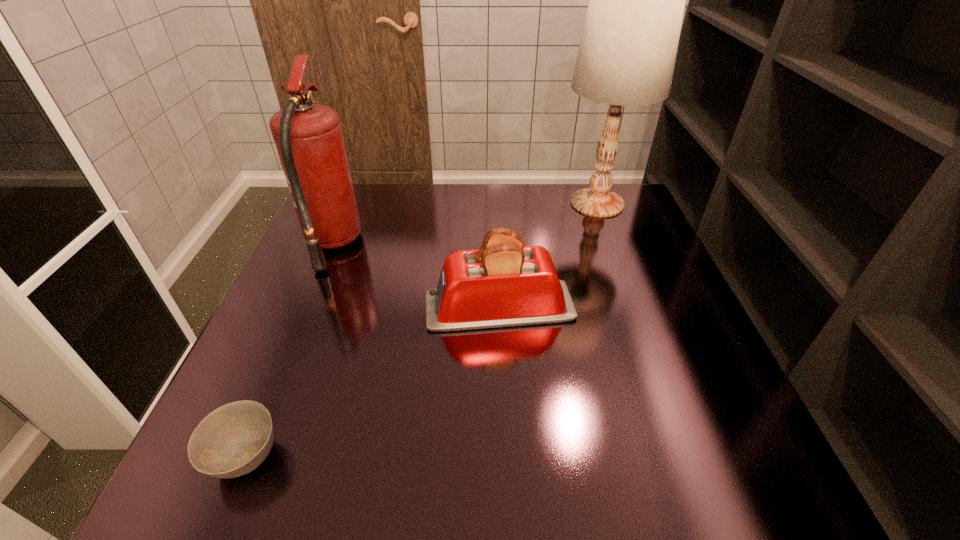
The height and width of the screenshot is (540, 960). Find the location of `free region that satisfies the following two spatial constraints: 1. at the front of the fire extinguisher where the nozzle is aimed; 2. on the right side of the bowl`. free region that satisfies the following two spatial constraints: 1. at the front of the fire extinguisher where the nozzle is aimed; 2. on the right side of the bowl is located at coordinates (242, 457).

I want to click on vacant space that satisfies the following two spatial constraints: 1. on the back side of the rightmost object; 2. on the left side of the second nearest object, so click(494, 203).